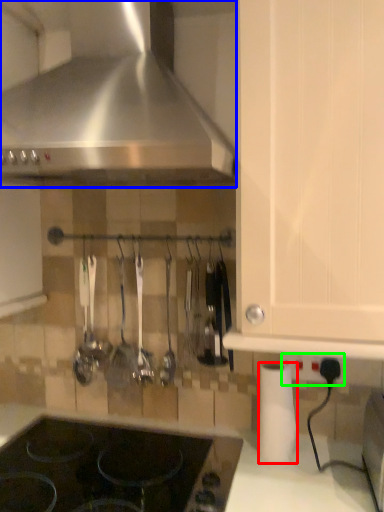
Question: Estimate the real-world distances between objects in this image. Which object is closer to paper towel (highlighted by a red box), kitchen appliance (highlighted by a blue box) or electric outlet (highlighted by a green box)?

Choices:
 (A) kitchen appliance
 (B) electric outlet

Answer: (B)